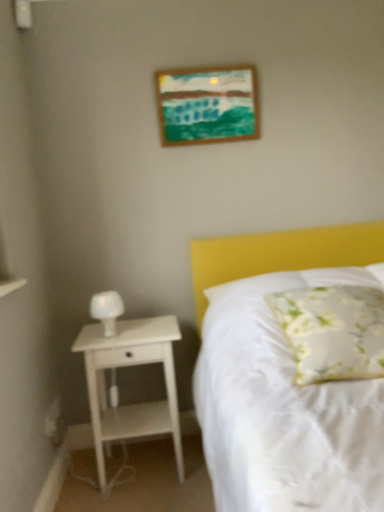
Question: Is white wood nightstand at left closer to camera compared to wooden picture frame at upper center?

Choices:
 (A) no
 (B) yes

Answer: (B)

Question: Can you confirm if white wood nightstand at left is shorter than wooden picture frame at upper center?

Choices:
 (A) no
 (B) yes

Answer: (A)

Question: Considering the relative positions of white wood nightstand at left and wooden picture frame at upper center in the image provided, is white wood nightstand at left to the right of wooden picture frame at upper center from the viewer's perspective?

Choices:
 (A) yes
 (B) no

Answer: (B)

Question: Is white wood nightstand at left far away from wooden picture frame at upper center?

Choices:
 (A) no
 (B) yes

Answer: (B)

Question: Is white wood nightstand at left taller than wooden picture frame at upper center?

Choices:
 (A) no
 (B) yes

Answer: (B)

Question: Is white wood nightstand at left completely or partially outside of wooden picture frame at upper center?

Choices:
 (A) no
 (B) yes

Answer: (B)

Question: Is wooden picture frame at upper center next to white wood nightstand at left?

Choices:
 (A) yes
 (B) no

Answer: (B)

Question: From a real-world perspective, is wooden picture frame at upper center physically above white wood nightstand at left?

Choices:
 (A) yes
 (B) no

Answer: (A)

Question: Is wooden picture frame at upper center looking in the opposite direction of white wood nightstand at left?

Choices:
 (A) yes
 (B) no

Answer: (B)

Question: Considering the relative sizes of wooden picture frame at upper center and white wood nightstand at left in the image provided, is wooden picture frame at upper center bigger than white wood nightstand at left?

Choices:
 (A) no
 (B) yes

Answer: (A)

Question: From the image's perspective, is wooden picture frame at upper center located beneath white wood nightstand at left?

Choices:
 (A) no
 (B) yes

Answer: (A)

Question: Could white wood nightstand at left be considered to be inside wooden picture frame at upper center?

Choices:
 (A) yes
 (B) no

Answer: (B)

Question: Is the depth of floral fabric pillow at center less than that of white wood nightstand at left?

Choices:
 (A) no
 (B) yes

Answer: (B)